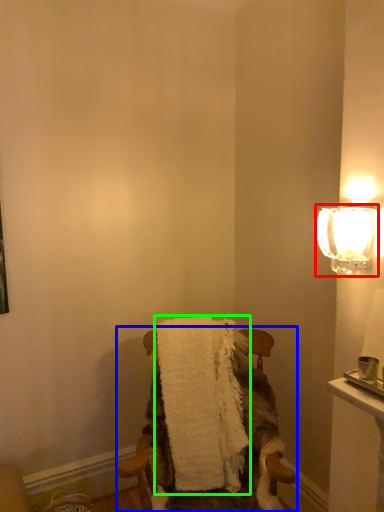
Question: Based on their relative distances, which object is farther from lamp (highlighted by a red box)? Choose from chair (highlighted by a blue box) and bath towel (highlighted by a green box).

Choices:
 (A) chair
 (B) bath towel

Answer: (B)